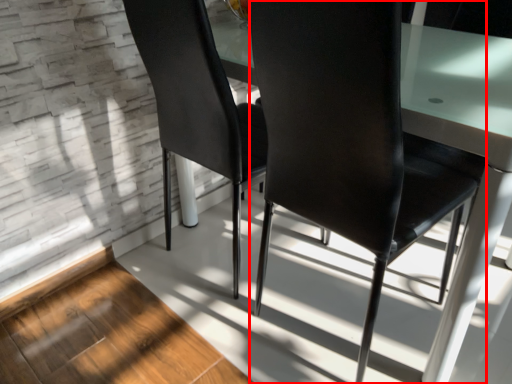
Question: From the image's perspective, considering the relative positions of chair (annotated by the red box) and chair in the image provided, where is chair (annotated by the red box) located with respect to the staircase?

Choices:
 (A) below
 (B) above

Answer: (A)